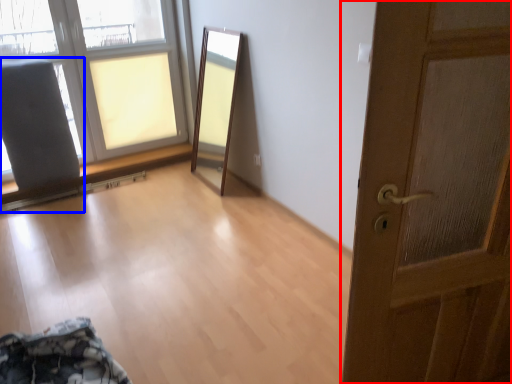
Question: Which of the following is the farthest to the observer, door (highlighted by a red box) or armchair (highlighted by a blue box)?

Choices:
 (A) door
 (B) armchair

Answer: (B)